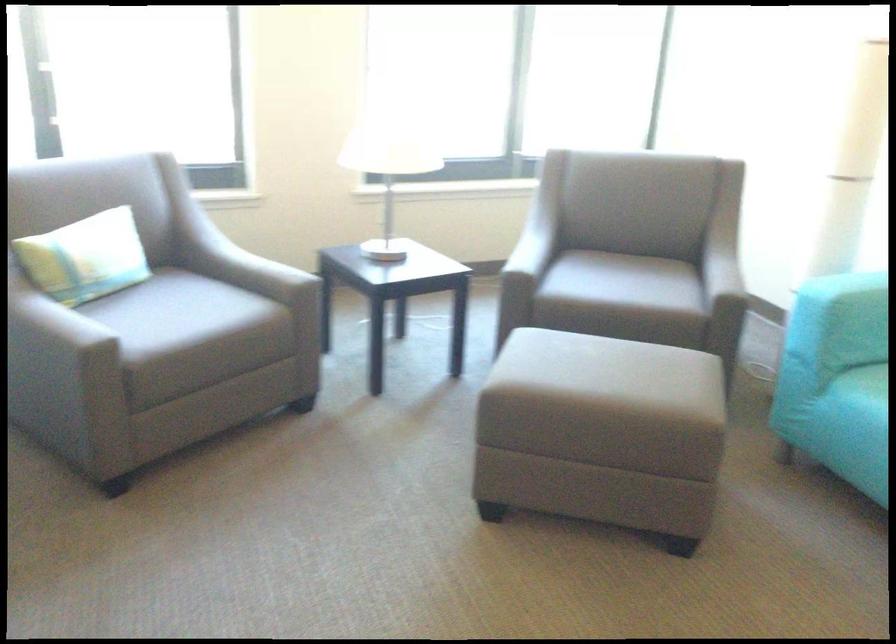
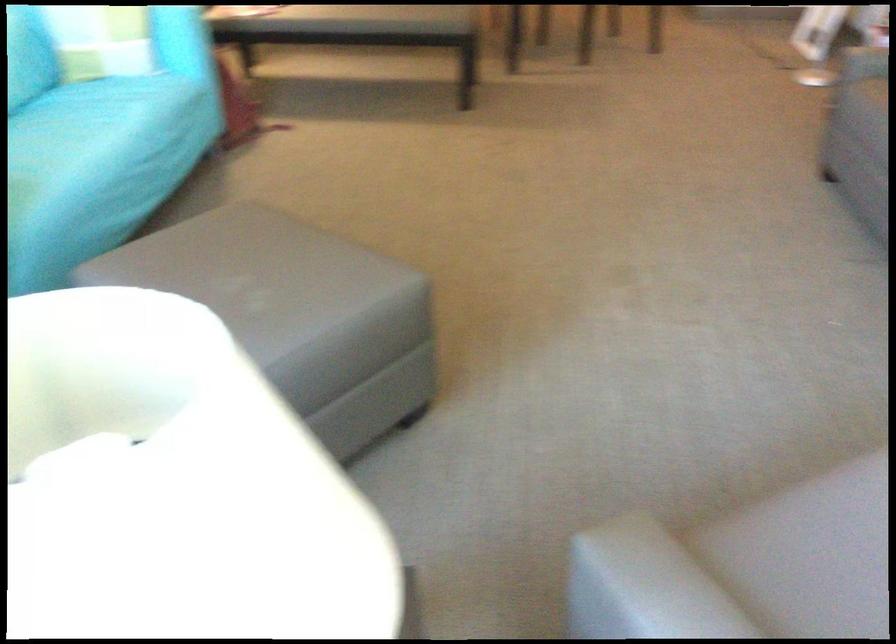
The point at (536, 351) is marked in the first image. Where is the corresponding point in the second image?

(282, 296)